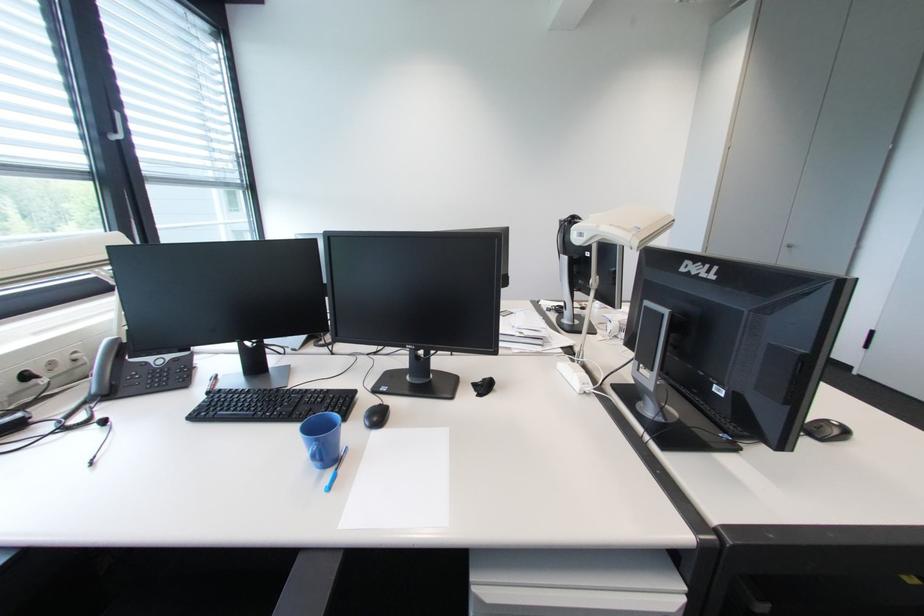
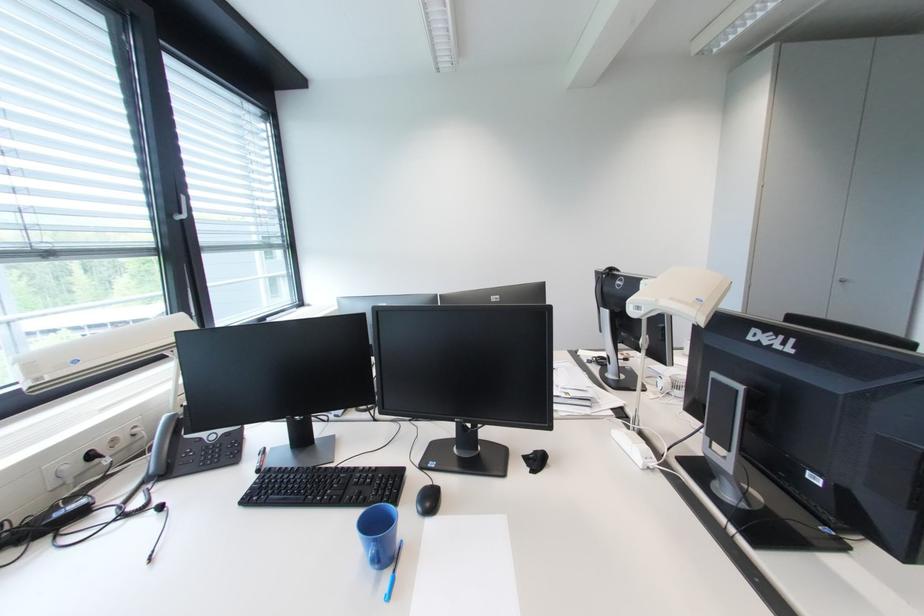
Find the pixel in the second image that matches point 490,381 in the first image.

(541, 454)